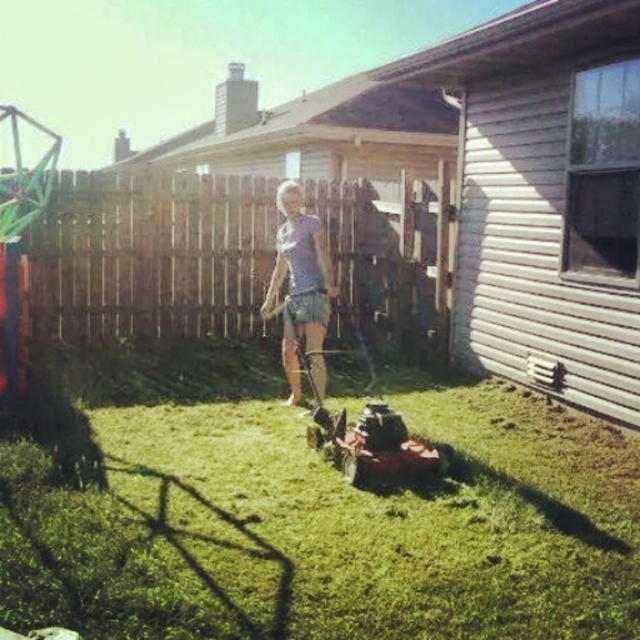
Question: Which of the following is the farthest from the observer?

Choices:
 (A) pos(205,483)
 (B) pos(296,284)
 (C) pos(60,220)

Answer: (C)

Question: Estimate the real-world distances between objects in this image. Which object is farther from the light blue denim shorts at center?

Choices:
 (A) green grass at center
 (B) brown wooden fence at center

Answer: (A)

Question: Does brown wooden fence at center lie in front of light blue denim shorts at center?

Choices:
 (A) no
 (B) yes

Answer: (A)

Question: Can you confirm if green grass at center is smaller than brown wooden fence at center?

Choices:
 (A) no
 (B) yes

Answer: (B)

Question: Does green grass at center lie in front of brown wooden fence at center?

Choices:
 (A) yes
 (B) no

Answer: (A)

Question: Which of these objects is positioned closest to the green grass at center?

Choices:
 (A) brown wooden fence at center
 (B) light blue denim shorts at center

Answer: (B)